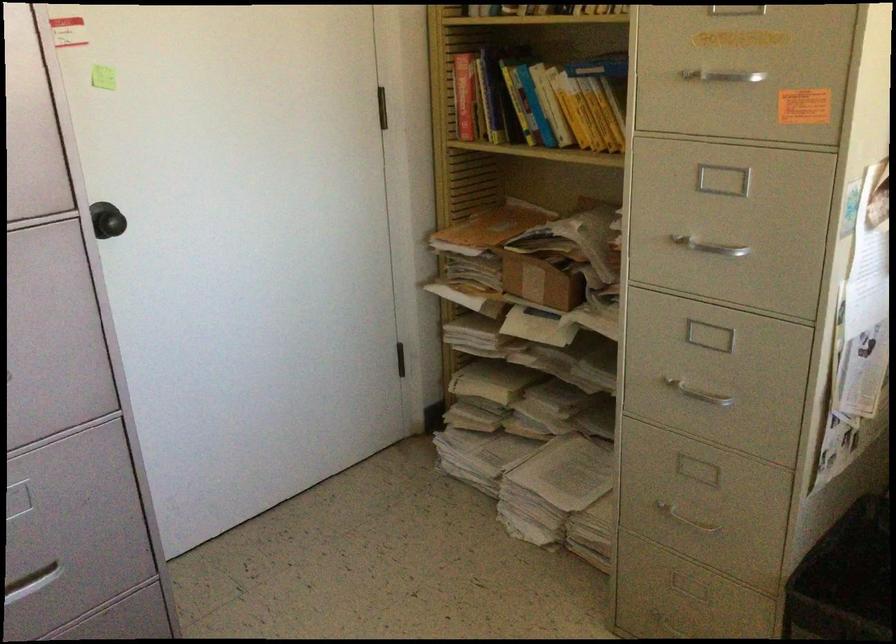
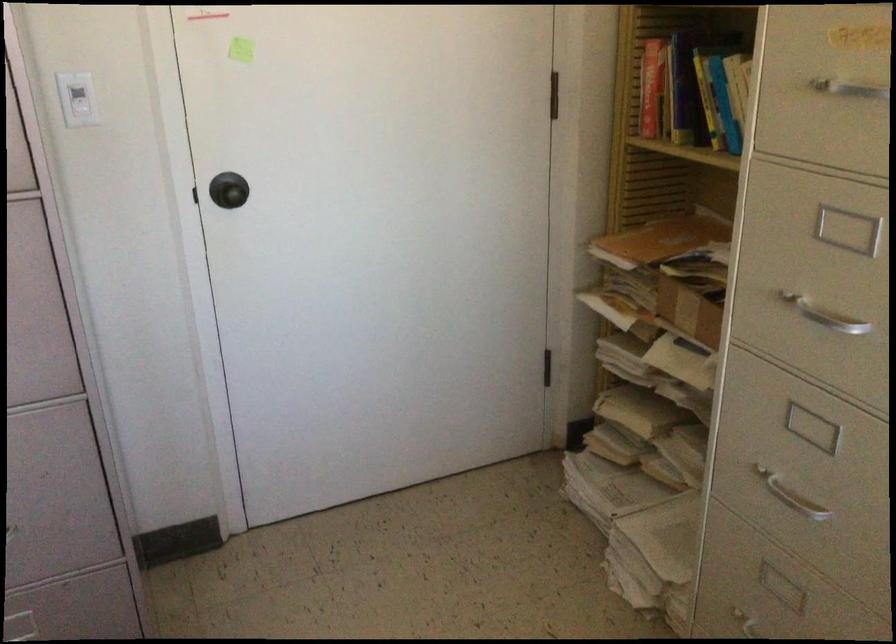
Find the pixel in the second image that matches pixel 709 242 in the first image.

(824, 315)